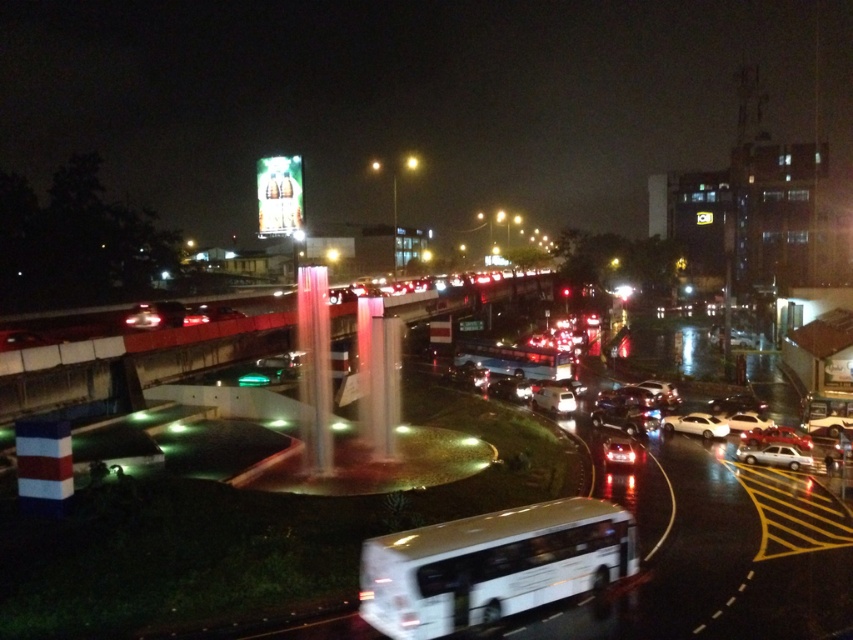
Between point (392, 536) and point (532, 362), which one is positioned behind?

Point (532, 362)

Is white glossy bus at center closer to camera compared to white matte bus at center?

Yes, it is in front of white matte bus at center.

At what (x,y) coordinates should I click in order to perform the action: click on white glossy bus at center. Please return your answer as a coordinate pair (x, y). Looking at the image, I should click on (492, 564).

Who is lower down, white glossy sedan at lower right or white glossy sedan at center?

white glossy sedan at lower right is lower down.

Looking at this image, between white glossy sedan at lower right and white glossy sedan at center, which one has less height?

With less height is white glossy sedan at lower right.

In the scene shown: Who is more forward, (781, 461) or (671, 417)?

Point (781, 461) is more forward.

This screenshot has width=853, height=640. In order to click on white glossy sedan at lower right in this screenshot , I will do [775, 456].

Who is more distant from viewer, (488, 369) or (747, 448)?

Positioned behind is point (488, 369).

Between point (544, 372) and point (785, 452), which one is positioned in front?

Point (785, 452) is more forward.

Is point (479, 348) farther from camera compared to point (799, 452)?

Yes, point (479, 348) is behind point (799, 452).

Identify the location of white matte bus at center. Image resolution: width=853 pixels, height=640 pixels. (514, 358).